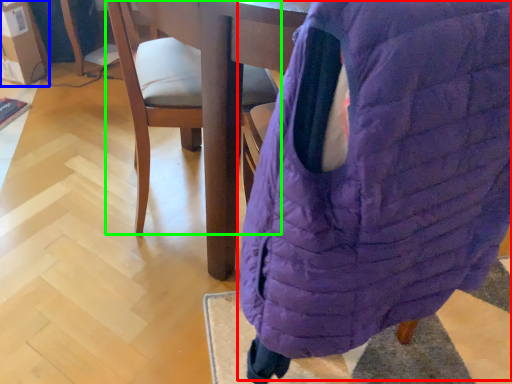
Question: Which object is positioned closest to bean bag chair (highlighted by a red box)? Select from cardboard box (highlighted by a blue box) and chair (highlighted by a green box).

Choices:
 (A) cardboard box
 (B) chair

Answer: (B)